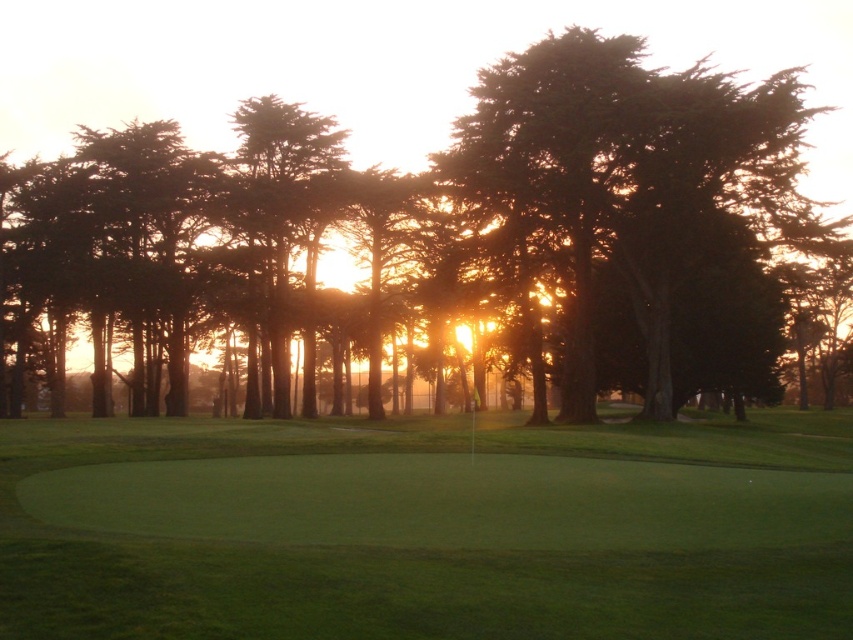
Can you confirm if green smooth grass at center is positioned to the left of green leafy tree at center?

Correct, you'll find green smooth grass at center to the left of green leafy tree at center.

Between point (602, 445) and point (743, 44), which one is positioned behind?

The point (743, 44) is more distant.

Find the location of a particular element. The height and width of the screenshot is (640, 853). green smooth grass at center is located at coordinates (425, 529).